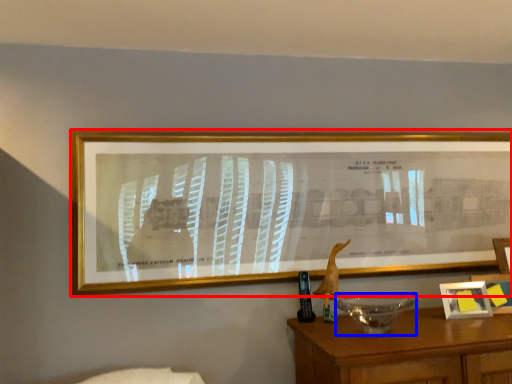
Question: Which object is closer to the camera taking this photo, picture frame (highlighted by a red box) or glass bowl (highlighted by a blue box)?

Choices:
 (A) picture frame
 (B) glass bowl

Answer: (B)